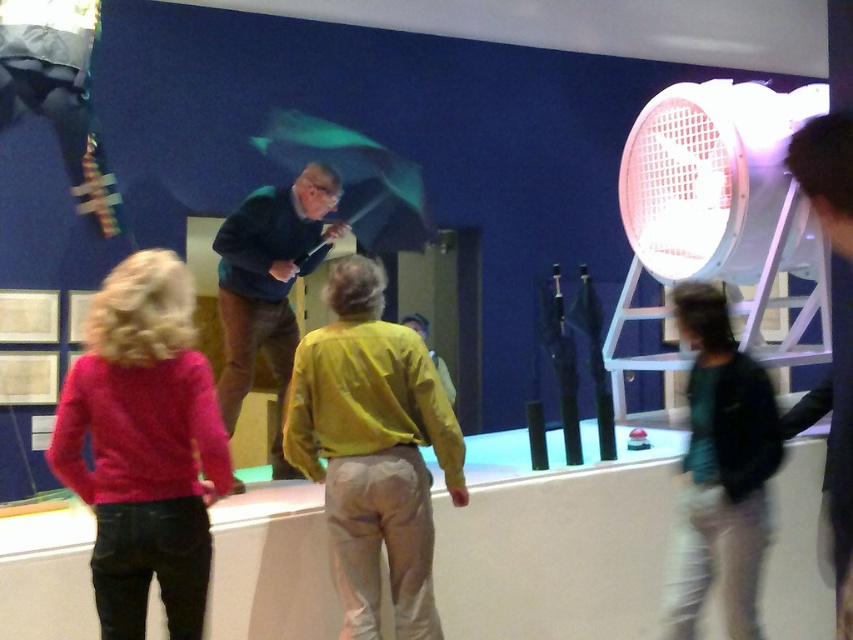
You are a security guard in the museum and need to ensure that the pink sweater at lower left and the green matte jacket at lower right are within the camera view. Which object is closer to the camera, and thus more likely to be fully visible?

The pink sweater at lower left is smaller than the green matte jacket at lower right, so it is likely closer to the camera and more fully visible.